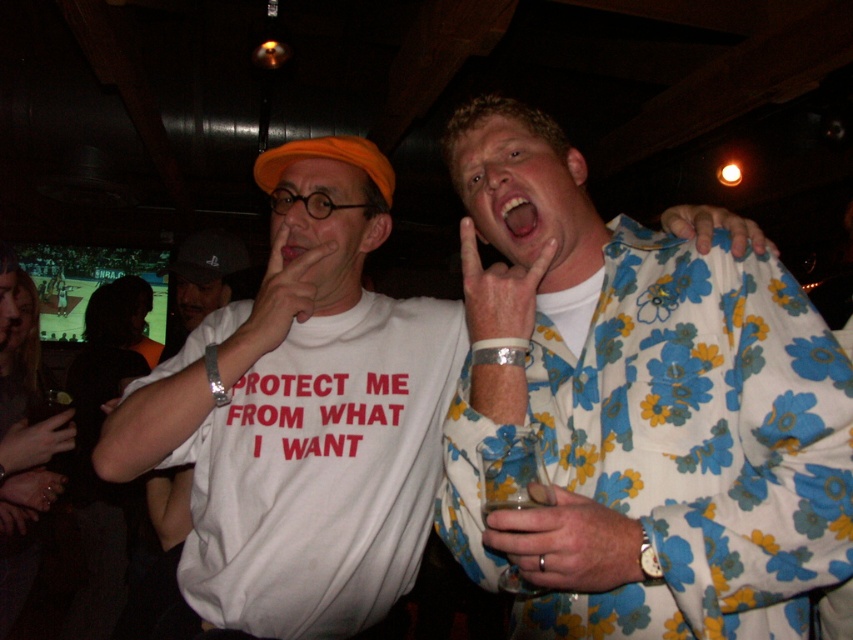
What is the color of the fabric at the point marked as point (303, 413)?

The point (303, 413) is on white fabric shirt at center, so the color is white.